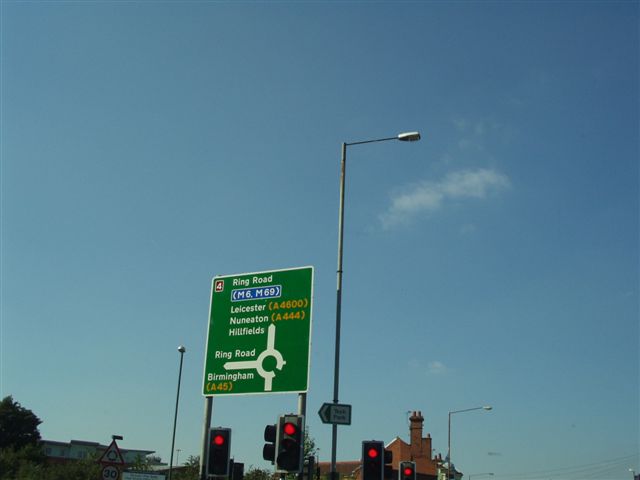
Where is `light`? light is located at coordinates (413, 134).